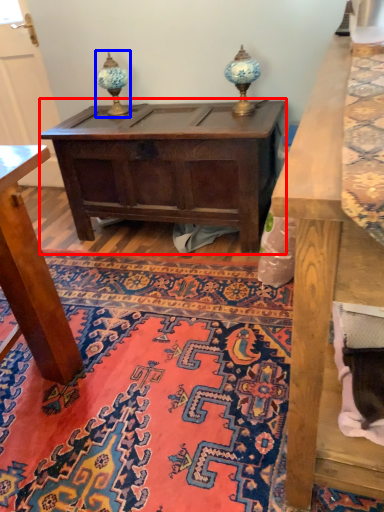
Question: Which object appears closest to the camera in this image, table (highlighted by a red box) or table lamp (highlighted by a blue box)?

Choices:
 (A) table
 (B) table lamp

Answer: (A)